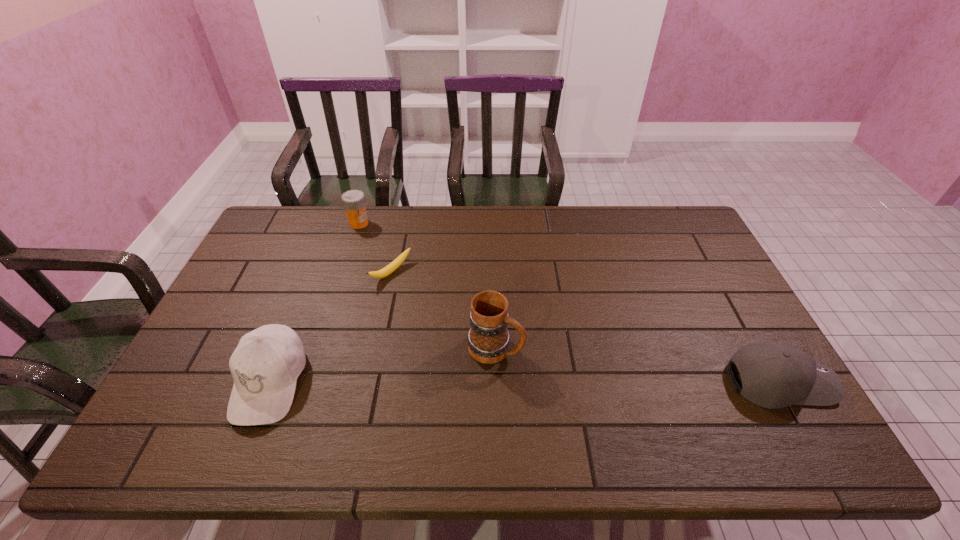
The width and height of the screenshot is (960, 540). In order to click on free point located 0.210m on the label side of the medicine in this screenshot , I will do `click(383, 264)`.

Where is `free region located on the label side of the medicine`? This screenshot has width=960, height=540. free region located on the label side of the medicine is located at coordinates (379, 258).

The image size is (960, 540). I want to click on vacant space located 0.360m on the label side of the medicine, so click(x=399, y=292).

Locate an element on the screen. Image resolution: width=960 pixels, height=540 pixels. vacant area situated 0.300m on the side of the second object from right to left with the handle is located at coordinates (631, 408).

This screenshot has height=540, width=960. Identify the location of vacant space situated 0.050m on the side of the second object from right to left with the handle. (537, 364).

You are a GUI agent. You are given a task and a screenshot of the screen. Output one action in this format:
    pyautogui.click(x=<x>, y=<y>)
    Task: Click on the vacant position located 0.280m on the side of the second object from right to left with the handle
    This screenshot has width=960, height=540.
    Given the screenshot: What is the action you would take?
    pyautogui.click(x=622, y=404)

In order to click on object at the far edge in this screenshot , I will do `click(353, 201)`.

At what (x,y) coordinates should I click in order to perform the action: click on object situated at the left edge. Please return your answer as a coordinate pair (x, y). The height and width of the screenshot is (540, 960). Looking at the image, I should click on (265, 366).

This screenshot has height=540, width=960. I want to click on object that is at the right edge, so click(774, 375).

Image resolution: width=960 pixels, height=540 pixels. I want to click on object located in the near left corner section of the desktop, so click(265, 366).